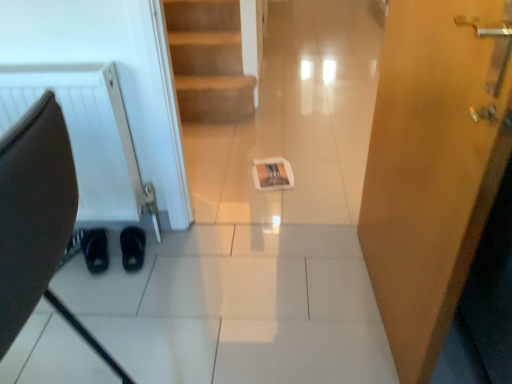
Identify the location of free location in front of black suede shoes at lower left, the first footwear positioned from the right. pyautogui.click(x=121, y=282).